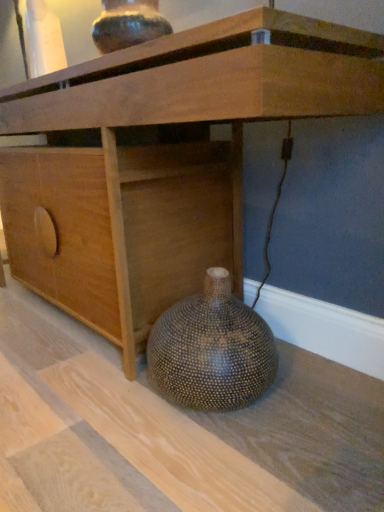
Question: Is speckled ceramic vase at upper center, the 2th vase when ordered from bottom to top, in front of or behind brown textured vase at lower right, the 1th vase in the bottom-to-top sequence, in the image?

Choices:
 (A) front
 (B) behind

Answer: (B)

Question: Does point (94, 39) appear closer or farther from the camera than point (218, 358)?

Choices:
 (A) closer
 (B) farther

Answer: (B)

Question: Which is nearer to the wooden cabinet at lower center?

Choices:
 (A) speckled ceramic vase at upper center, the 2th vase when ordered from bottom to top
 (B) brown textured vase at lower right, the 1th vase in the bottom-to-top sequence

Answer: (A)

Question: Which is nearer to the brown textured vase at lower right, the 1th vase in the bottom-to-top sequence?

Choices:
 (A) wooden cabinet at lower center
 (B) speckled ceramic vase at upper center, the 2th vase when ordered from bottom to top

Answer: (A)